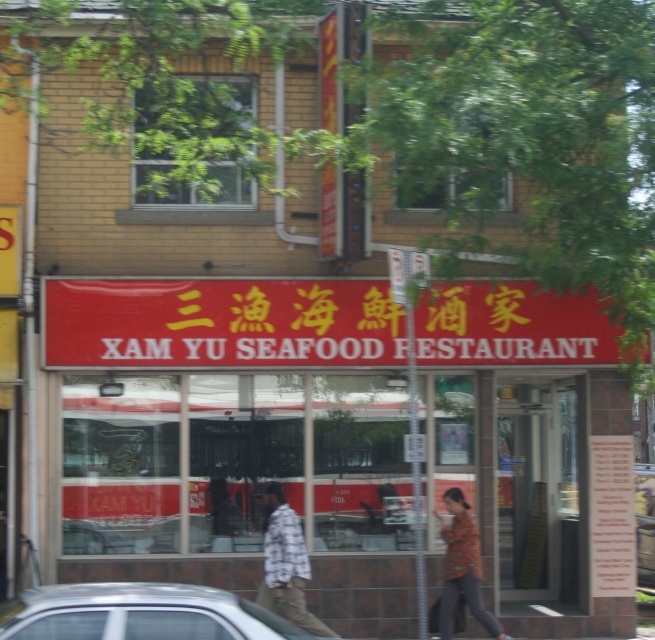
You are standing in front of the XAM YU SEAFOOD RESTAURANT and notice the red matte sign at center and the flannel shirt at center. Which object is closer to you?

The red matte sign at center is closer to you because it is further to the viewer than the flannel shirt at center.